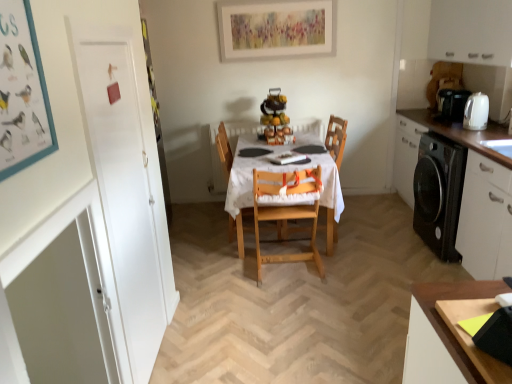
This screenshot has height=384, width=512. Find the location of `spots to the right of wooden chair at center`. spots to the right of wooden chair at center is located at coordinates point(364,232).